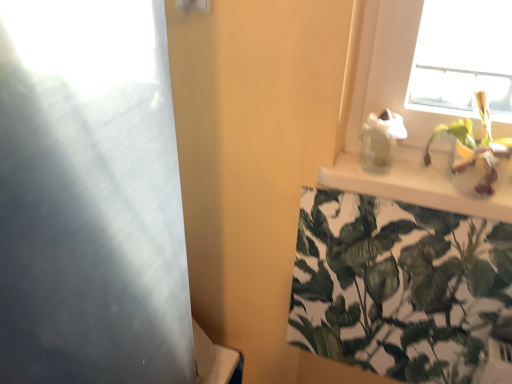
Question: Considering the positions of transparent glass screen door at left and green leafy plant at upper right, which is counted as the 2th houseplant, starting from the bottom, in the image, is transparent glass screen door at left wider or thinner than green leafy plant at upper right, which is counted as the 2th houseplant, starting from the bottom,?

Choices:
 (A) thin
 (B) wide

Answer: (B)

Question: From the image's perspective, is transparent glass screen door at left positioned above or below green leafy plant at upper right, arranged as the first houseplant when viewed from the top?

Choices:
 (A) above
 (B) below

Answer: (B)

Question: Which of these objects is positioned closest to the green leafy plant at upper right, which is counted as the 2th houseplant, starting from the bottom?

Choices:
 (A) transparent glass screen door at left
 (B) green leafy plant at upper right, the 1th houseplant positioned from the bottom
 (C) white glossy shelf at upper right

Answer: (C)

Question: Estimate the real-world distances between objects in this image. Which object is closer to the transparent glass screen door at left?

Choices:
 (A) green leafy plant at upper right, which is counted as the 2th houseplant, starting from the bottom
 (B) green leafy plant at upper right, the 1th houseplant positioned from the bottom
 (C) white glossy shelf at upper right

Answer: (C)